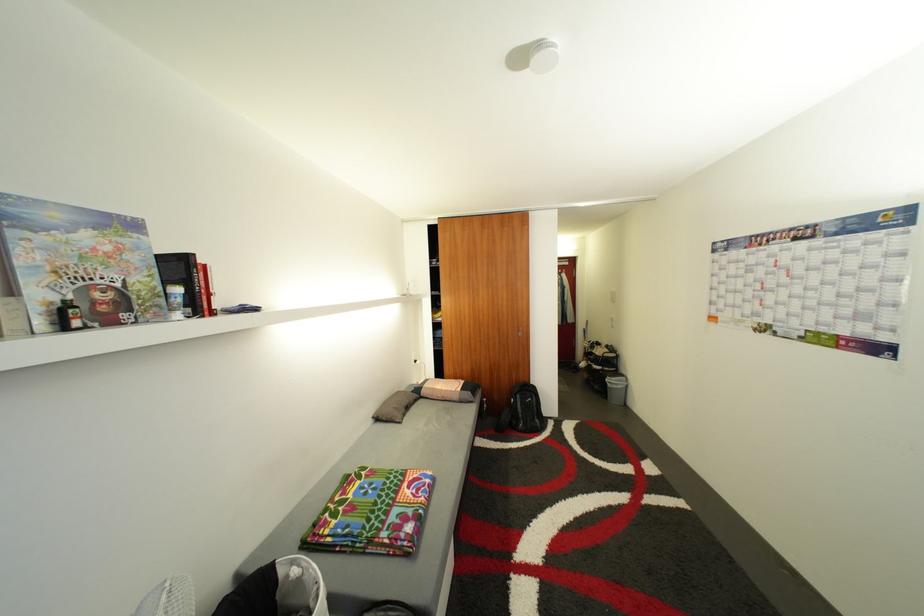
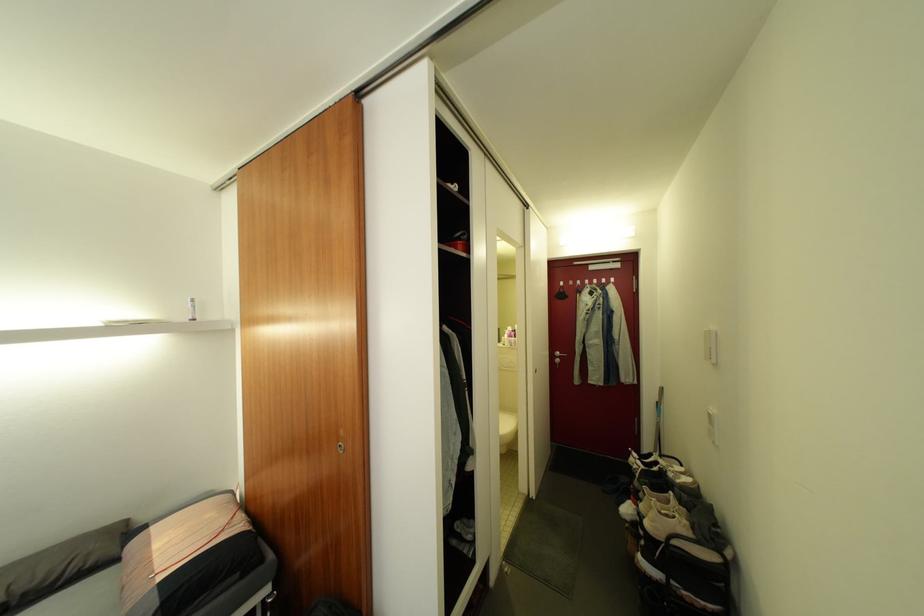
The images are taken continuously from a first-person perspective. In which direction are you moving?

The movement direction of the cameraman is right, forward.